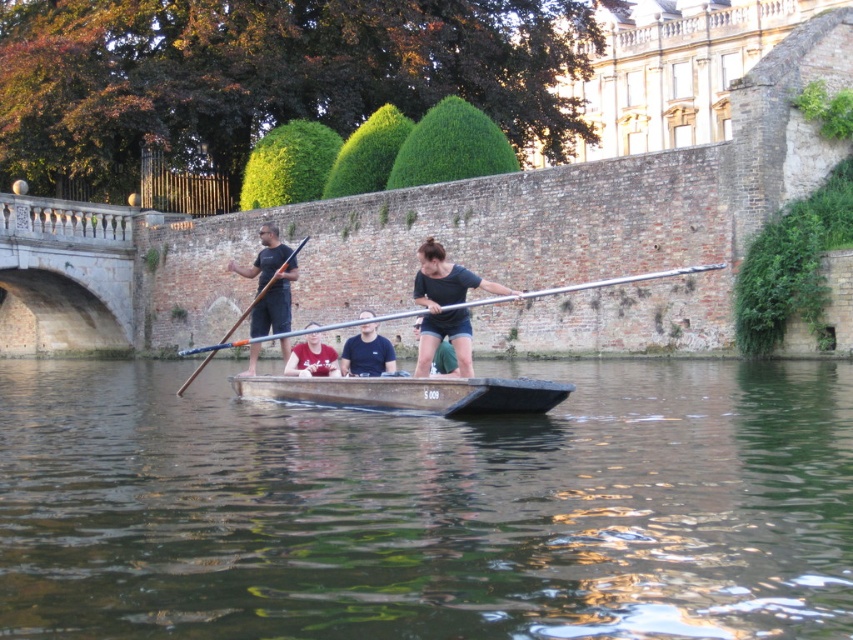
Please describe the position of the matte black shirt at center in terms of coordinates within the image frame. The image frame is represented as a coordinate system where the bottom left corner is the origin point. The x and y axes increase to the right and upwards respectively. The coordinates are normalized between 0 and 1. Please provide the coordinates as a tuple of two decimal numbers rounded to three decimal places.

The matte black shirt at center is located at coordinates approximately equal to the point given in the Objects Description, which is at point (x=445, y=305). Therefore, the coordinates are approximately 0.477 in the x direction and 0.523 in the y direction.